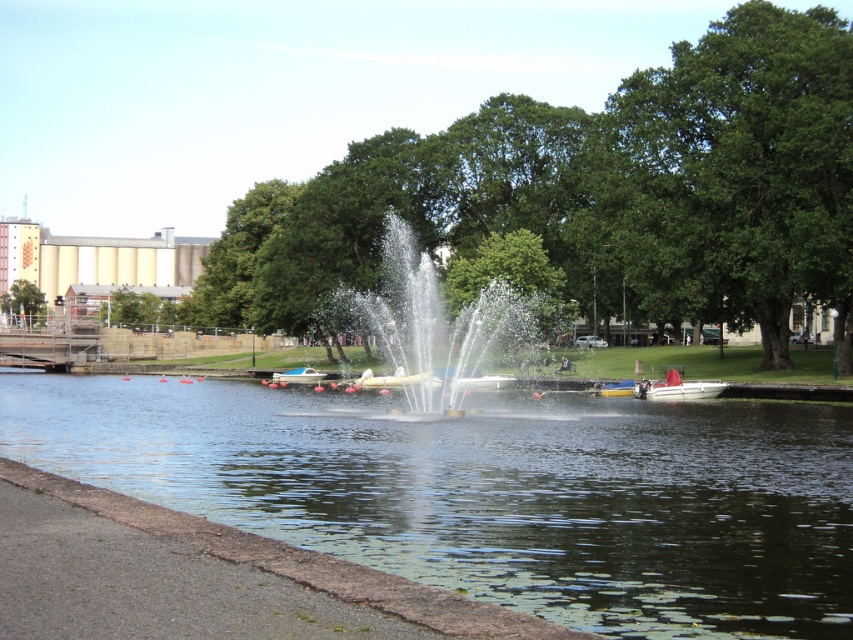
Is white plastic boat at center above yellow matte boat at center?

Actually, white plastic boat at center is below yellow matte boat at center.

How far apart are white plastic boat at center and yellow matte boat at center?

They are 28.97 meters apart.

This screenshot has width=853, height=640. What do you see at coordinates (299, 376) in the screenshot?
I see `white plastic boat at center` at bounding box center [299, 376].

Where is `white plastic boat at center`? This screenshot has height=640, width=853. white plastic boat at center is located at coordinates (299, 376).

Is point (465, 314) less distant than point (599, 388)?

That is False.

Which of these two, clear water fountain at center or yellow matte boat at center, stands taller?

With more height is clear water fountain at center.

Is point (393, 273) farther from camera compared to point (606, 381)?

Yes, point (393, 273) is behind point (606, 381).

Identify the location of clear water fountain at center. Image resolution: width=853 pixels, height=640 pixels. (436, 321).

Who is taller, white glossy boat at right or green leafy tree at left?

green leafy tree at left is taller.

Measure the distance between white glossy boat at right and green leafy tree at left.

white glossy boat at right and green leafy tree at left are 127.25 meters apart.

Does point (639, 388) come farther from viewer compared to point (24, 294)?

No, (639, 388) is closer to viewer.

The width and height of the screenshot is (853, 640). In order to click on white glossy boat at right in this screenshot , I will do `click(677, 388)`.